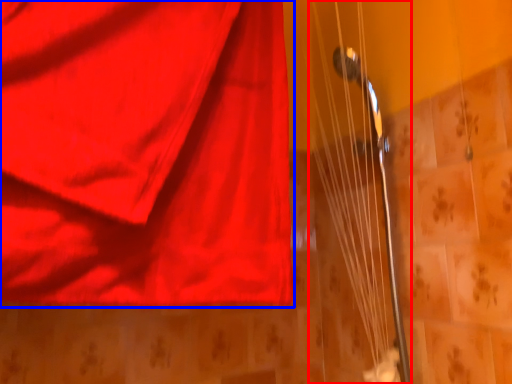
Question: Among these objects, which one is farthest to the camera, string (highlighted by a red box) or curtain (highlighted by a blue box)?

Choices:
 (A) string
 (B) curtain

Answer: (A)